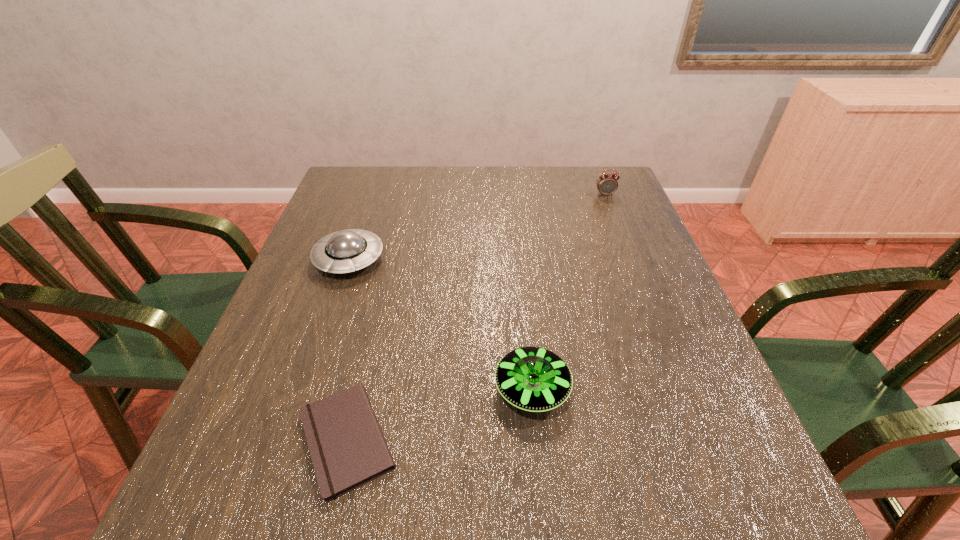
This screenshot has width=960, height=540. What are the coordinates of `vacant area between the farther saucer and the shortest object` in the screenshot? It's located at (348, 349).

Where is `vacant area that lies between the shortest object and the farther saucer`? vacant area that lies between the shortest object and the farther saucer is located at coordinates (348, 349).

This screenshot has height=540, width=960. Identify the location of unoccupied area between the checkbook and the farther saucer. pyautogui.click(x=348, y=349).

Where is `blank region between the shortest object and the nearer saucer`? The height and width of the screenshot is (540, 960). blank region between the shortest object and the nearer saucer is located at coordinates (440, 414).

Select which object appears as the third closest to the nearer saucer. Please provide its 2D coordinates. Your answer should be formatted as a tuple, i.e. [(x, y)], where the tuple contains the x and y coordinates of a point satisfying the conditions above.

[(607, 184)]

Locate an element on the screen. The image size is (960, 540). the third closest object to the right saucer is located at coordinates (607, 184).

The width and height of the screenshot is (960, 540). Find the location of `free region that satisfies the following two spatial constraints: 1. on the back side of the third object from left to right; 2. on the right side of the checkbook`. free region that satisfies the following two spatial constraints: 1. on the back side of the third object from left to right; 2. on the right side of the checkbook is located at coordinates (359, 389).